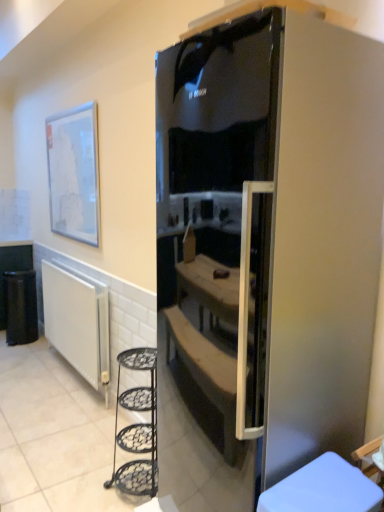
In order to face white ribbed radiator at lower left, should I rotate leftwards or rightwards?

Rotate left and turn 16.014 degrees.

What do you see at coordinates (78, 320) in the screenshot? This screenshot has width=384, height=512. I see `white ribbed radiator at lower left` at bounding box center [78, 320].

Describe the element at coordinates (74, 173) in the screenshot. I see `matte white picture frame at upper left` at that location.

Image resolution: width=384 pixels, height=512 pixels. Describe the element at coordinates (20, 307) in the screenshot. I see `black plastic trash bin at lower left` at that location.

Where is `white ribbed radiator at lower left`? The height and width of the screenshot is (512, 384). white ribbed radiator at lower left is located at coordinates (78, 320).

Does black plastic trash bin at lower left turn towards satin black fridge at center?

No, black plastic trash bin at lower left does not turn towards satin black fridge at center.

Considering the sizes of objects black plastic trash bin at lower left and satin black fridge at center in the image provided, who is wider, black plastic trash bin at lower left or satin black fridge at center?

satin black fridge at center.

Considering their positions, is black plastic trash bin at lower left located in front of or behind satin black fridge at center?

In the image, black plastic trash bin at lower left appears behind satin black fridge at center.

From the picture: Which point is more distant from viewer, (23, 273) or (207, 93)?

The point (23, 273) is more distant.

Considering the positions of objects matte white picture frame at upper left and white plastic stool at lower right in the image provided, who is more to the left, matte white picture frame at upper left or white plastic stool at lower right?

matte white picture frame at upper left.

Could you tell me if matte white picture frame at upper left is turned towards white plastic stool at lower right?

No, matte white picture frame at upper left is not turned towards white plastic stool at lower right.

Can you confirm if matte white picture frame at upper left is shorter than white plastic stool at lower right?

Incorrect, the height of matte white picture frame at upper left does not fall short of that of white plastic stool at lower right.

Is white ribbed radiator at lower left located outside white plastic stool at lower right?

Absolutely, white ribbed radiator at lower left is external to white plastic stool at lower right.

Which object is thinner, white ribbed radiator at lower left or white plastic stool at lower right?

white ribbed radiator at lower left is thinner.

From a real-world perspective, is white ribbed radiator at lower left physically below white plastic stool at lower right?

Yes.

Who is taller, white ribbed radiator at lower left or white plastic stool at lower right?

white ribbed radiator at lower left.

Does black plastic trash bin at lower left turn towards white ribbed radiator at lower left?

No, black plastic trash bin at lower left does not turn towards white ribbed radiator at lower left.

From the image's perspective, does black plastic trash bin at lower left appear lower than white ribbed radiator at lower left?

Actually, black plastic trash bin at lower left appears above white ribbed radiator at lower left in the image.

Is black plastic trash bin at lower left with white ribbed radiator at lower left?

No, black plastic trash bin at lower left is not beside white ribbed radiator at lower left.

Where is `radiator on the right of black plastic trash bin at lower left`? This screenshot has height=512, width=384. radiator on the right of black plastic trash bin at lower left is located at coordinates (78, 320).

Does white plastic stool at lower right have a greater height compared to satin black fridge at center?

In fact, white plastic stool at lower right may be shorter than satin black fridge at center.

Which object is further away from the camera taking this photo, white plastic stool at lower right or satin black fridge at center?

white plastic stool at lower right is more distant.

The image size is (384, 512). I want to click on furniture lying below the satin black fridge at center (from the image's perspective), so click(x=323, y=489).

Can you confirm if white plastic stool at lower right is positioned to the right of satin black fridge at center?

Yes, white plastic stool at lower right is to the right of satin black fridge at center.

Is satin black fridge at center inside the boundaries of white plastic stool at lower right, or outside?

satin black fridge at center lies outside white plastic stool at lower right.

Is satin black fridge at center closer to camera compared to white plastic stool at lower right?

Yes, it is in front of white plastic stool at lower right.

Is the surface of satin black fridge at center in direct contact with white plastic stool at lower right?

No, satin black fridge at center is not making contact with white plastic stool at lower right.

Based on the photo, is satin black fridge at center outside of black plastic trash bin at lower left?

Absolutely, satin black fridge at center is external to black plastic trash bin at lower left.

Does satin black fridge at center have a greater height compared to black plastic trash bin at lower left?

Yes, satin black fridge at center is taller than black plastic trash bin at lower left.

Is satin black fridge at center oriented towards black plastic trash bin at lower left?

No, satin black fridge at center is not aimed at black plastic trash bin at lower left.

You are a GUI agent. You are given a task and a screenshot of the screen. Output one action in this format:
    pyautogui.click(x=<x>, y=<y>)
    Task: Click on the refrigerator above the black plastic trash bin at lower left (from a real-world perspective)
    The image size is (384, 512).
    Given the screenshot: What is the action you would take?
    pyautogui.click(x=272, y=229)

Locate an element on the screen. The width and height of the screenshot is (384, 512). trash bin/can below the satin black fridge at center (from the image's perspective) is located at coordinates (20, 307).

Find the location of a particular element. picture frame behind the white plastic stool at lower right is located at coordinates (74, 173).

Looking at the image, which one is located further to matte white picture frame at upper left, white plastic stool at lower right or black plastic trash bin at lower left?

Based on the image, white plastic stool at lower right appears to be further to matte white picture frame at upper left.

From the image, which object appears to be farther from matte white picture frame at upper left, black plastic trash bin at lower left or white ribbed radiator at lower left?

Among the two, black plastic trash bin at lower left is located further to matte white picture frame at upper left.

Which object lies further to the anchor point black plastic trash bin at lower left, matte white picture frame at upper left or white plastic stool at lower right?

white plastic stool at lower right is positioned further to the anchor black plastic trash bin at lower left.

Which object lies further to the anchor point matte white picture frame at upper left, black plastic trash bin at lower left or satin black fridge at center?

Among the two, satin black fridge at center is located further to matte white picture frame at upper left.

Based on their spatial positions, is black plastic trash bin at lower left or matte white picture frame at upper left closer to white plastic stool at lower right?

matte white picture frame at upper left lies closer to white plastic stool at lower right than the other object.

From the image, which object appears to be farther from white ribbed radiator at lower left, satin black fridge at center or black plastic trash bin at lower left?

The object further to white ribbed radiator at lower left is satin black fridge at center.

From the image, which object appears to be farther from satin black fridge at center, matte white picture frame at upper left or black plastic trash bin at lower left?

Among the two, black plastic trash bin at lower left is located further to satin black fridge at center.

Estimate the real-world distances between objects in this image. Which object is further from white plastic stool at lower right, matte white picture frame at upper left or satin black fridge at center?

matte white picture frame at upper left is further to white plastic stool at lower right.

Locate an element on the screen. This screenshot has width=384, height=512. furniture between satin black fridge at center and black plastic trash bin at lower left along the z-axis is located at coordinates (323, 489).

The width and height of the screenshot is (384, 512). Find the location of `trash bin/can between matte white picture frame at upper left and white ribbed radiator at lower left in the vertical direction`. trash bin/can between matte white picture frame at upper left and white ribbed radiator at lower left in the vertical direction is located at coordinates (20, 307).

Where is `furniture between satin black fridge at center and white ribbed radiator at lower left in the front-back direction`? The height and width of the screenshot is (512, 384). furniture between satin black fridge at center and white ribbed radiator at lower left in the front-back direction is located at coordinates (323, 489).

Identify the location of picture frame positioned between satin black fridge at center and black plastic trash bin at lower left from near to far. The height and width of the screenshot is (512, 384). (74, 173).